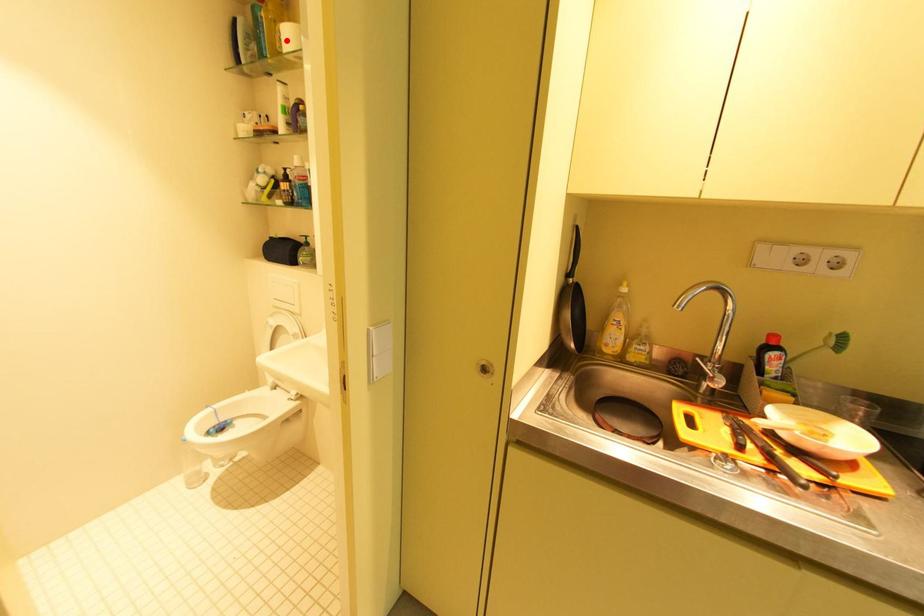
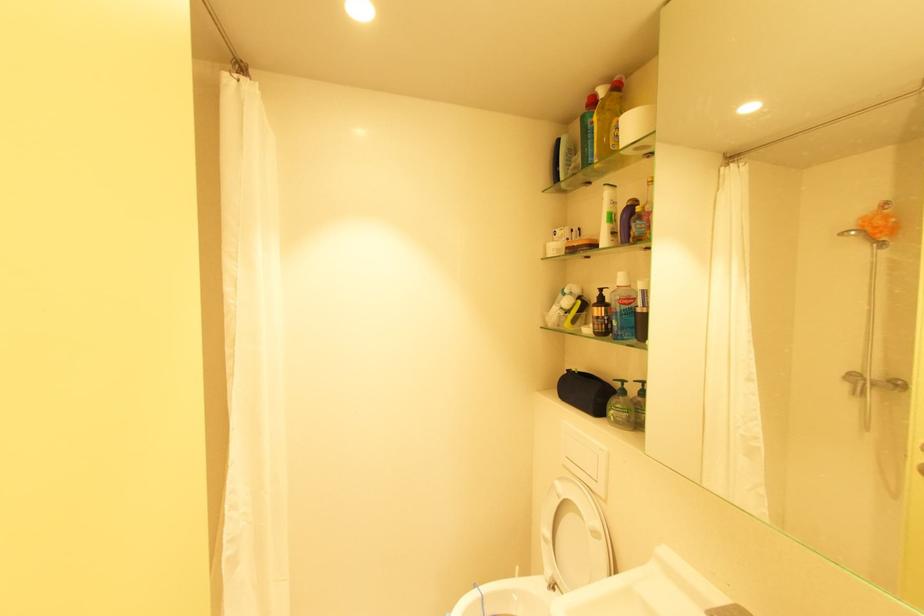
Find the pixel in the second image that matches the highlighted location in the first image.

(623, 136)